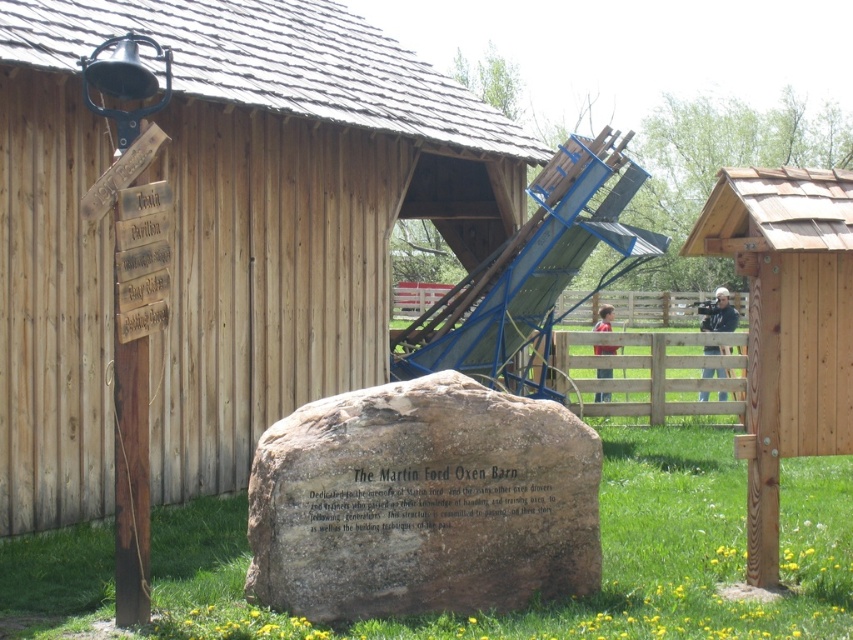
You are standing at the origin point of the coordinate system. You want to walk to the wooden hut at center. Which direction should you go?

You should go to the direction of point (221, 230) from your current position.

You are a visitor at the Martin Ford Oxen Barn. You see the brown rough stone at center and the wooden post at right. Which object is closer to the ground?

The brown rough stone at center is positioned under the wooden post at right, so the brown rough stone at center is closer to the ground.

You are a farmer checking the condition of your land. You notice the green grass at center and the wooden at center. Which area would require more water based on their current state?

The green grass at center is thinner than wooden at center, so the green grass at center requires more water to thicken it up.